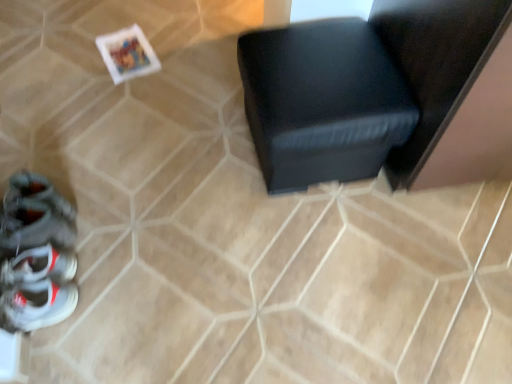
Locate an element on the screen. The image size is (512, 384). shiny gray sneaker at lower left is located at coordinates (33, 227).

In order to click on white leather sneakers at lower left in this screenshot , I will do [36, 254].

Is white leather sneakers at lower left far away from black leather ottoman at center?

No, there isn't a large distance between white leather sneakers at lower left and black leather ottoman at center.

Is white leather sneakers at lower left facing away from black leather ottoman at center?

Yes, black leather ottoman at center is at the back of white leather sneakers at lower left.

Is black leather ottoman at center completely or partially inside white leather sneakers at lower left?

Definitely not — black leather ottoman at center is not inside white leather sneakers at lower left.

In terms of height, does white leather sneakers at lower left look taller or shorter compared to black leather ottoman at center?

In the image, white leather sneakers at lower left appears to be shorter than black leather ottoman at center.

Looking at this image, can you confirm if shiny gray sneaker at lower left is wider than white leather sneakers at lower left?

No.

Considering the positions of point (25, 206) and point (68, 204), is point (25, 206) closer or farther from the camera than point (68, 204)?

Point (25, 206) is closer to the camera than point (68, 204).

Can you confirm if shiny gray sneaker at lower left is bigger than white leather sneakers at lower left?

Yes, shiny gray sneaker at lower left is bigger than white leather sneakers at lower left.

Is shiny gray sneaker at lower left completely or partially outside of white leather sneakers at lower left?

Indeed, shiny gray sneaker at lower left is completely outside white leather sneakers at lower left.

From the picture: Is white leather sneakers at lower left bigger or smaller than shiny gray sneaker at lower left?

white leather sneakers at lower left is smaller than shiny gray sneaker at lower left.

In the scene shown: From a real-world perspective, is white leather sneakers at lower left positioned above or below shiny gray sneaker at lower left?

From a real-world perspective, white leather sneakers at lower left is physically below shiny gray sneaker at lower left.

Measure the distance from white leather sneakers at lower left to shiny gray sneaker at lower left.

They are 1.66 inches apart.

Does white leather sneakers at lower left have a lesser height compared to shiny gray sneaker at lower left?

Correct, white leather sneakers at lower left is not as tall as shiny gray sneaker at lower left.

Is shiny gray sneaker at lower left at the right side of black leather ottoman at center?

No.

Between shiny gray sneaker at lower left and black leather ottoman at center, which one is positioned behind?

shiny gray sneaker at lower left is further away from the camera.

Is shiny gray sneaker at lower left next to black leather ottoman at center and touching it?

There is a gap between shiny gray sneaker at lower left and black leather ottoman at center.

Locate an element on the screen. Image resolution: width=512 pixels, height=384 pixels. furniture above the shiny gray sneaker at lower left (from the image's perspective) is located at coordinates (385, 92).

From a real-world perspective, is black leather ottoman at center physically below white leather sneakers at lower left?

No, from a real-world perspective, black leather ottoman at center is not beneath white leather sneakers at lower left.

Is black leather ottoman at center positioned with its back to white leather sneakers at lower left?

That's not correct — black leather ottoman at center is not looking away from white leather sneakers at lower left.

Is point (345, 158) closer or farther from the camera than point (71, 259)?

Point (345, 158) is positioned closer to the camera compared to point (71, 259).

Which is more to the right, black leather ottoman at center or shiny gray sneaker at lower left?

black leather ottoman at center is more to the right.

Is shiny gray sneaker at lower left surrounded by black leather ottoman at center?

Actually, shiny gray sneaker at lower left is outside black leather ottoman at center.

Is black leather ottoman at center facing away from shiny gray sneaker at lower left?

No, black leather ottoman at center is not facing the opposite direction of shiny gray sneaker at lower left.

Who is smaller, black leather ottoman at center or shiny gray sneaker at lower left?

shiny gray sneaker at lower left is smaller.

This screenshot has height=384, width=512. In order to click on footwear that is on the left side of black leather ottoman at center in this screenshot , I will do `click(36, 254)`.

This screenshot has height=384, width=512. I want to click on shoe above the white leather sneakers at lower left (from a real-world perspective), so click(x=33, y=227).

Estimate the real-world distances between objects in this image. Which object is further from white leather sneakers at lower left, black leather ottoman at center or shiny gray sneaker at lower left?

black leather ottoman at center lies further to white leather sneakers at lower left than the other object.

When comparing their distances from black leather ottoman at center, does shiny gray sneaker at lower left or white leather sneakers at lower left seem further?

The object further to black leather ottoman at center is shiny gray sneaker at lower left.

When comparing their distances from shiny gray sneaker at lower left, does black leather ottoman at center or white leather sneakers at lower left seem further?

Based on the image, black leather ottoman at center appears to be further to shiny gray sneaker at lower left.

From the image, which object appears to be nearer to black leather ottoman at center, white leather sneakers at lower left or shiny gray sneaker at lower left?

white leather sneakers at lower left lies closer to black leather ottoman at center than the other object.

Looking at this image, estimate the real-world distances between objects in this image. Which object is closer to white leather sneakers at lower left, shiny gray sneaker at lower left or black leather ottoman at center?

shiny gray sneaker at lower left is closer to white leather sneakers at lower left.

When comparing their distances from shiny gray sneaker at lower left, does white leather sneakers at lower left or black leather ottoman at center seem further?

Among the two, black leather ottoman at center is located further to shiny gray sneaker at lower left.

Identify the location of footwear located between shiny gray sneaker at lower left and black leather ottoman at center in the left-right direction. (36, 254).